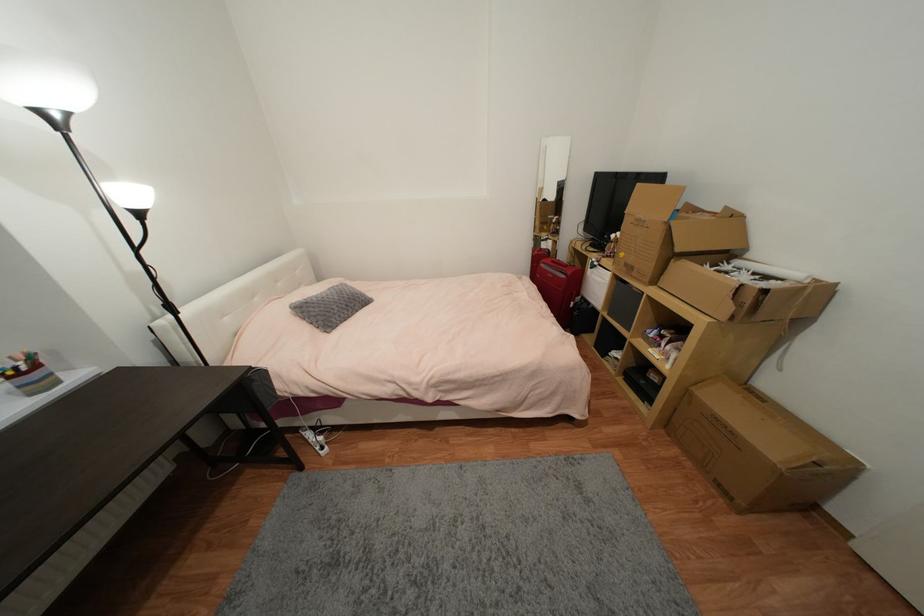
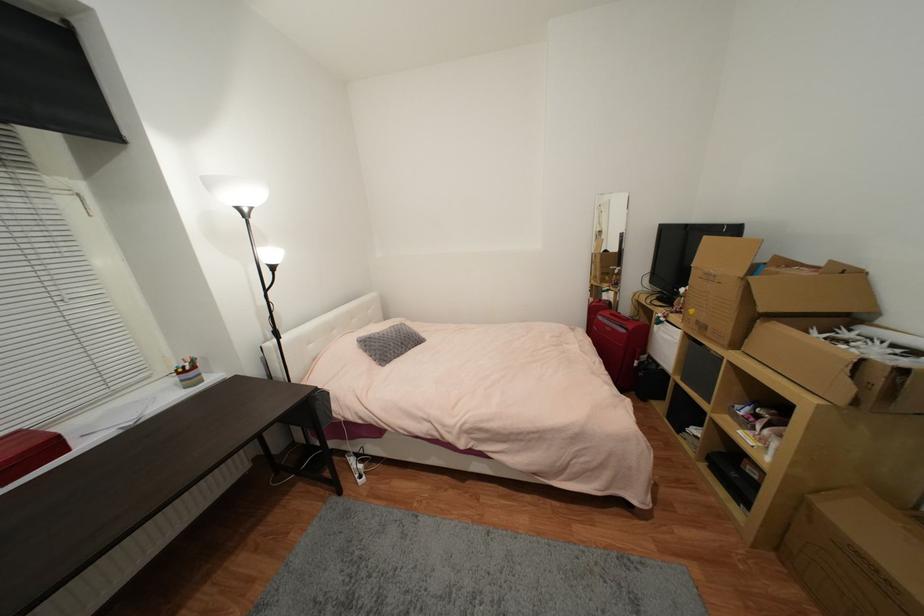
In the second image, find the point that corresponds to [671,426] in the first image.

(782, 546)